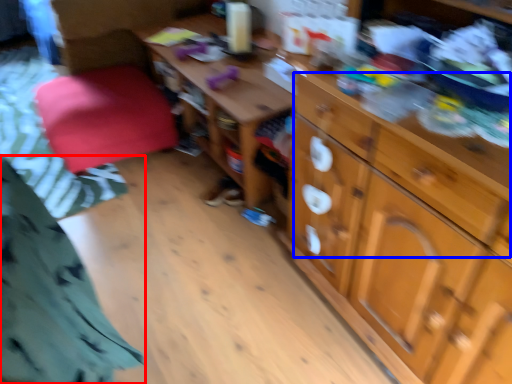
Question: Among these objects, which one is farthest to the camera, clothing (highlighted by a red box) or drawer (highlighted by a blue box)?

Choices:
 (A) clothing
 (B) drawer

Answer: (B)